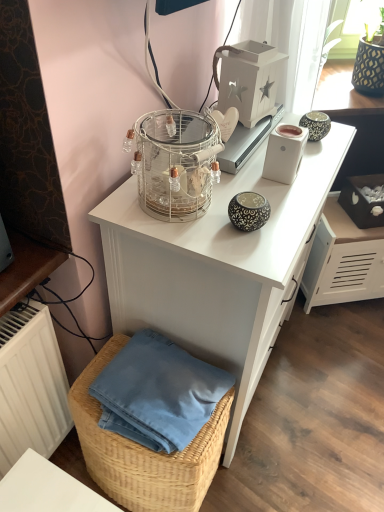
Where is `vacant space to the right of woven straw basket at lower left`? The image size is (384, 512). vacant space to the right of woven straw basket at lower left is located at coordinates pos(253,464).